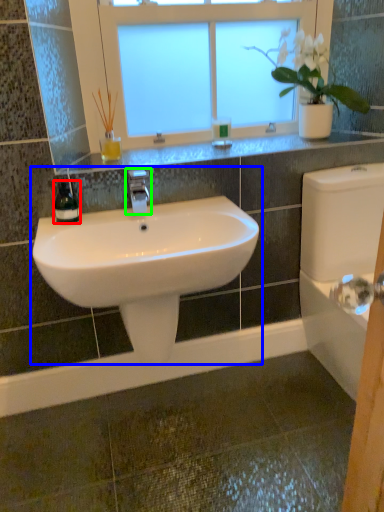
Question: Which is farther away from soap dispenser (highlighted by a red box)? sink (highlighted by a blue box) or tap (highlighted by a green box)?

Choices:
 (A) sink
 (B) tap

Answer: (A)